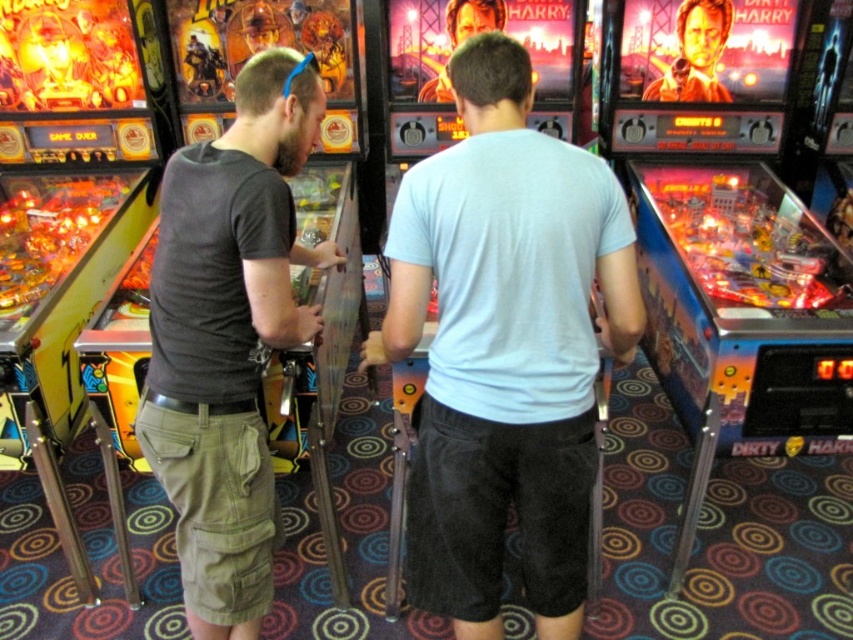
Does point (689, 54) lie behind point (469, 22)?

That is True.

You are a GUI agent. You are given a task and a screenshot of the screen. Output one action in this format:
    pyautogui.click(x=<x>, y=<y>)
    Task: Click on the smooth plastic face at center
    The image size is (853, 640).
    Given the screenshot: What is the action you would take?
    pyautogui.click(x=695, y=52)

Is point (714, 76) positioned after point (444, 74)?

Yes, it is.

Identify the location of smooth plastic face at center. (695, 52).

Who is more distant from viewer, (x=477, y=518) or (x=264, y=531)?

Point (x=264, y=531)

Is point (494, 314) in front of point (241, 580)?

Yes, it is in front of point (241, 580).

Between point (502, 499) and point (263, 317), which one is positioned in front?

Point (263, 317) is more forward.

Identify the location of light blue t-shirt at center. (505, 346).

Is light blue t-shirt at center smaller than smooth brown hair at upper center?

No.

This screenshot has height=640, width=853. Find the location of `light blue t-shirt at center`. light blue t-shirt at center is located at coordinates [x=505, y=346].